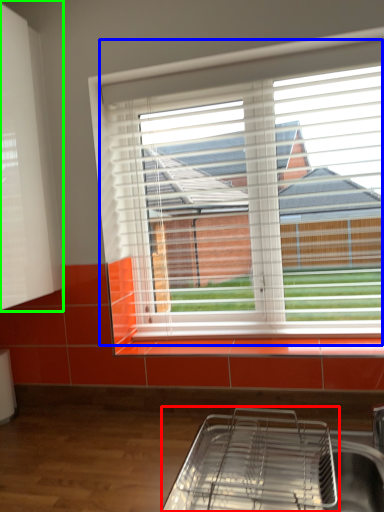
Question: Based on their relative distances, which object is farther from appliance (highlighted by a red box)? Choose from window (highlighted by a blue box) and shutter (highlighted by a green box).

Choices:
 (A) window
 (B) shutter

Answer: (B)